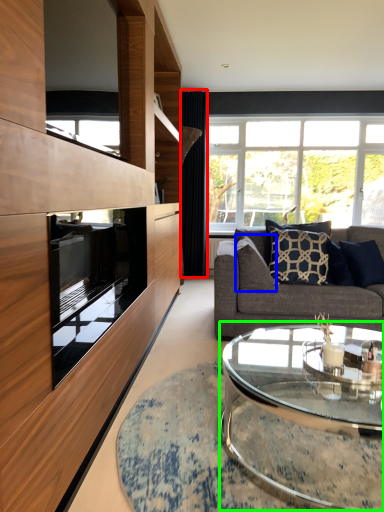
Question: Based on their relative distances, which object is farther from curtain (highlighted by a red box)? Choose from pillow (highlighted by a blue box) and coffee table (highlighted by a green box).

Choices:
 (A) pillow
 (B) coffee table

Answer: (B)